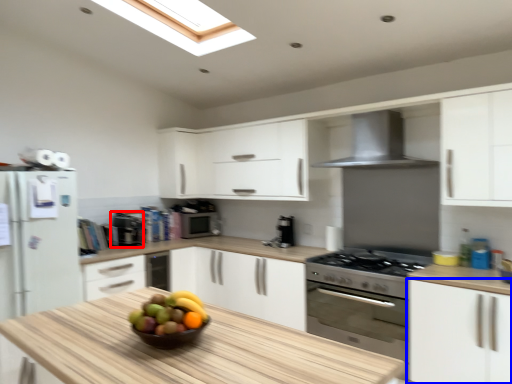
Question: Among these objects, which one is farthest to the camera, appliance (highlighted by a red box) or cabinetry (highlighted by a blue box)?

Choices:
 (A) appliance
 (B) cabinetry

Answer: (A)